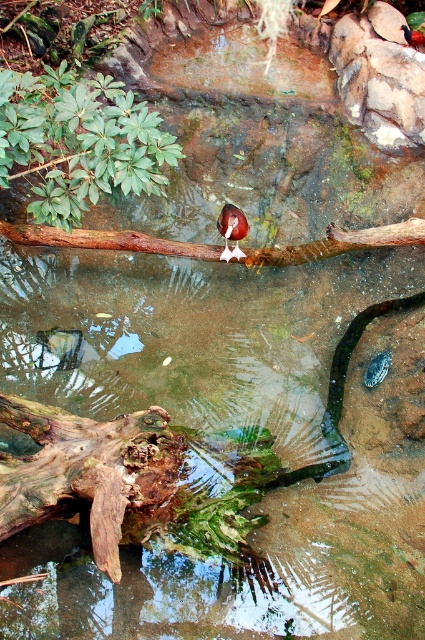
Question: Is green leafy plant at upper left to the right of brown feathered bird at center from the viewer's perspective?

Choices:
 (A) no
 (B) yes

Answer: (A)

Question: Considering the real-world distances, which object is farthest from the green leafy plant at upper left?

Choices:
 (A) brown glossy bird at center
 (B) brown wood at center

Answer: (A)

Question: Is the position of green leafy plant at upper left less distant than that of brown glossy bird at center?

Choices:
 (A) yes
 (B) no

Answer: (A)

Question: Among these objects, which one is farthest from the camera?

Choices:
 (A) brown glossy bird at center
 (B) brown feathered bird at center
 (C) brown wood at center
 (D) green leafy plant at upper left

Answer: (A)

Question: Among these points, which one is farthest from the camera?

Choices:
 (A) (74, 74)
 (B) (223, 232)

Answer: (A)

Question: Is green leafy plant at upper left above brown wood at center?

Choices:
 (A) yes
 (B) no

Answer: (A)